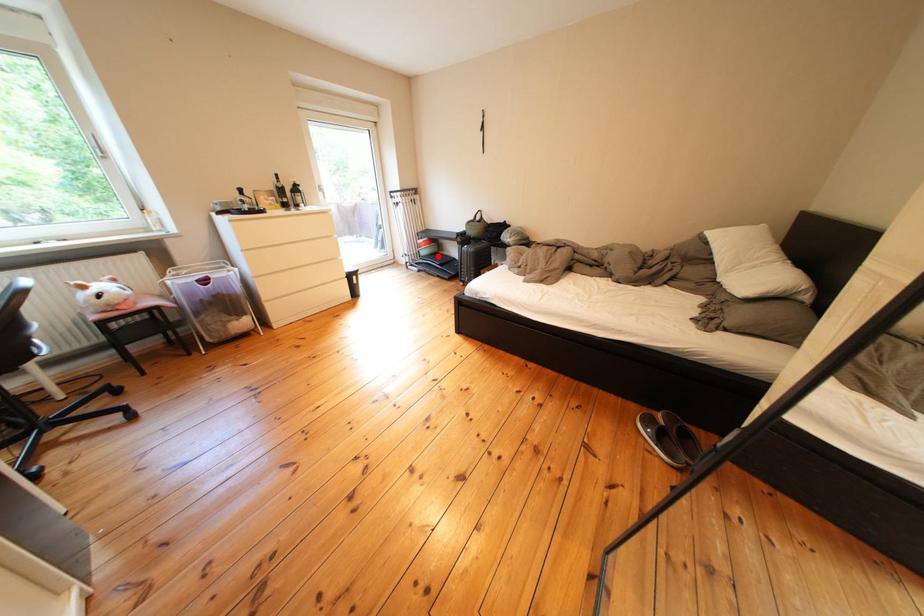
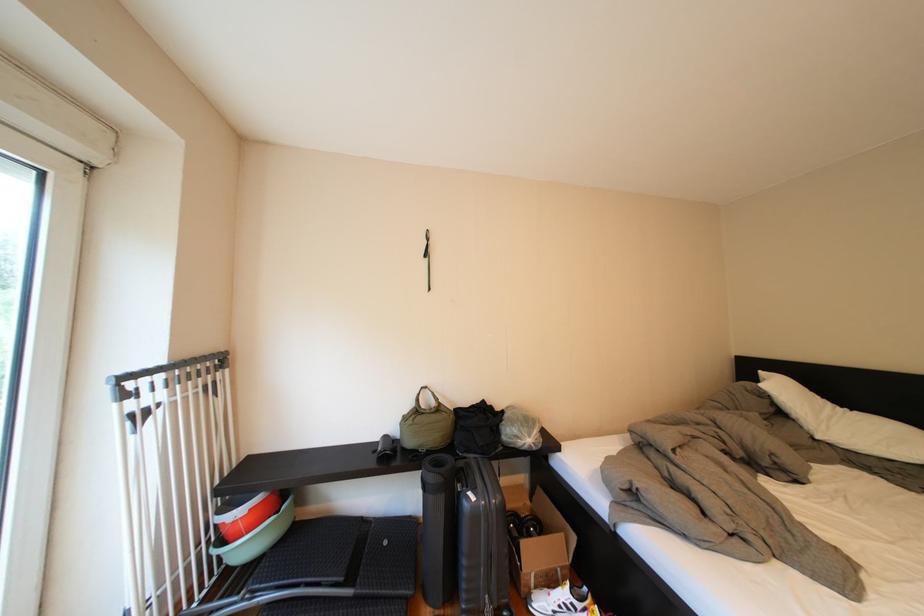
In the second image, find the point that corresponds to the highlighted location in the first image.

(261, 551)